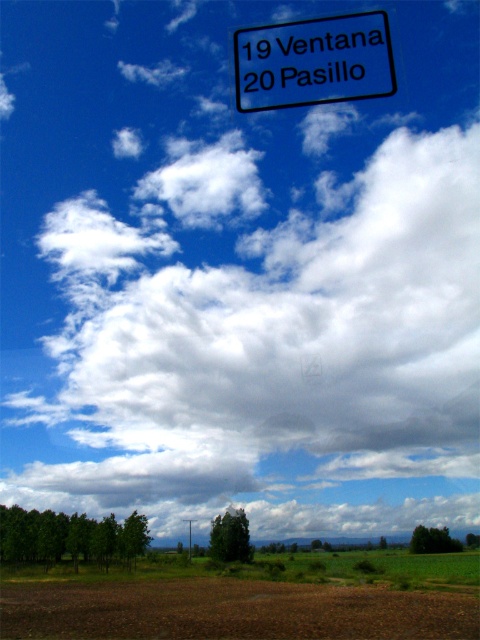
Who is more forward, (418, 550) or (191, 528)?

Point (418, 550) is in front.

The width and height of the screenshot is (480, 640). Describe the element at coordinates (432, 540) in the screenshot. I see `green leafy tree at lower right` at that location.

The image size is (480, 640). I want to click on green leafy tree at lower right, so click(x=432, y=540).

Can you confirm if black plastic sign at upper center is wider than green matte trees at lower left?

No.

Is point (324, 17) behind point (23, 561)?

No, (324, 17) is closer to viewer.

Where is `black plastic sign at upper center`? black plastic sign at upper center is located at coordinates (313, 61).

Is black plastic sign at upper center positioned before metallic pole at center?

Yes, it is in front of metallic pole at center.

Which of these two, black plastic sign at upper center or metallic pole at center, stands taller?

metallic pole at center

You are a GUI agent. You are given a task and a screenshot of the screen. Output one action in this format:
    pyautogui.click(x=<x>, y=<y>)
    Task: Click on the black plastic sign at upper center
    Image resolution: width=480 pixels, height=640 pixels.
    Given the screenshot: What is the action you would take?
    pyautogui.click(x=313, y=61)